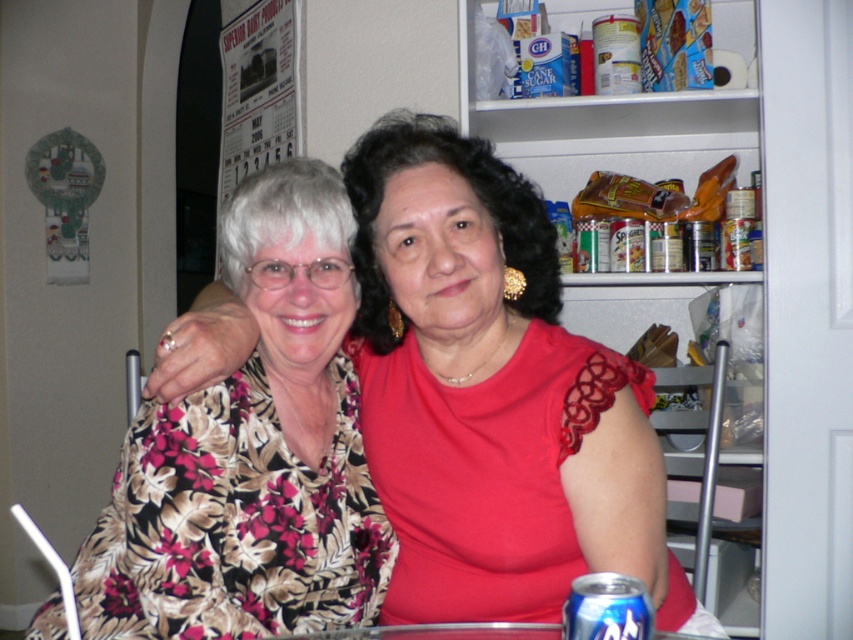
Question: Estimate the real-world distances between objects in this image. Which object is closer to the blue metallic can at lower center?

Choices:
 (A) floral-patterned blouse at center
 (B) floral fabric blouse at center

Answer: (B)

Question: Does floral fabric blouse at center lie behind blue metallic can at lower center?

Choices:
 (A) yes
 (B) no

Answer: (A)

Question: Where is floral fabric blouse at center located in relation to blue metallic can at lower center in the image?

Choices:
 (A) above
 (B) below

Answer: (A)

Question: Which point is farther to the camera?

Choices:
 (A) blue metallic can at lower center
 (B) floral-patterned blouse at center
 (C) floral fabric blouse at center

Answer: (B)

Question: Observing the image, what is the correct spatial positioning of floral fabric blouse at center in reference to blue metallic can at lower center?

Choices:
 (A) above
 (B) below

Answer: (A)

Question: Which point is farther to the camera?

Choices:
 (A) (461, 321)
 (B) (289, 371)
 (C) (619, 579)

Answer: (B)